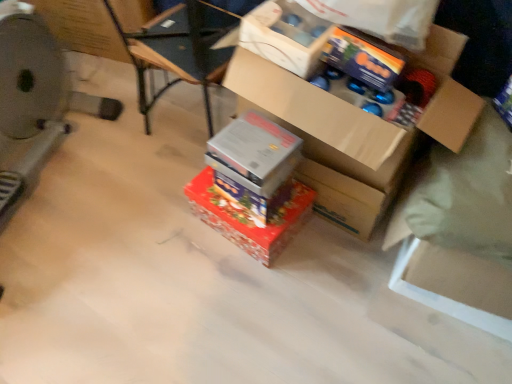
Locate an element on the screen. The height and width of the screenshot is (384, 512). empty space that is to the right of shiny metallic box at center, the first box in the bottom-to-top sequence is located at coordinates (335, 251).